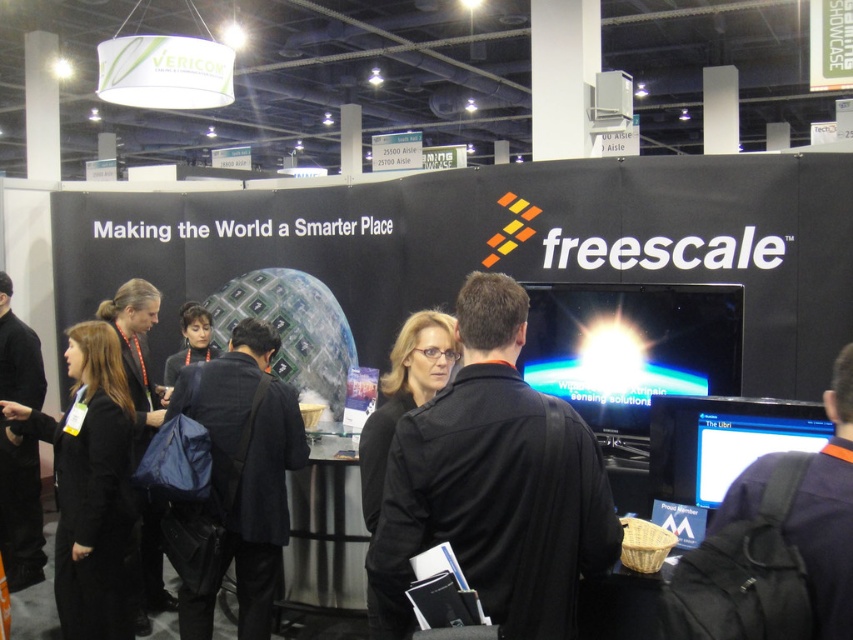
You are an event organizer at the Freescale booth and notice two black fabric items at the center of the booth. Which one is positioned higher between the black fabric jacket at center and the black fabric coat at center?

The black fabric jacket at center is positioned higher than the black fabric coat at center.

You are standing at the entrance of the Freescale booth and want to reach the black fabric coat at center without getting too close to the black fabric at center. What is the minimum distance you need to move forward from your current position?

The black fabric at center is 1.66 meters away from the black fabric coat at center. To avoid getting too close to the black fabric at center, you should move forward at least 1.66 meters to reach the black fabric coat at center safely.

You are an event organizer at the Freescale booth. You need to determine if the black fabric at center can be used to cover the black fabric jacket at center without any adjustments. Based on their sizes, what do you think?

The black fabric at center is wider than the black fabric jacket at center, so it can cover the jacket without needing adjustments.